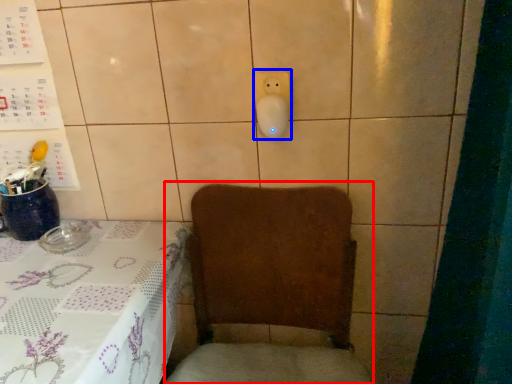
Question: Which point is closer to the camera, armchair (highlighted by a red box) or electric outlet (highlighted by a blue box)?

Choices:
 (A) armchair
 (B) electric outlet

Answer: (A)